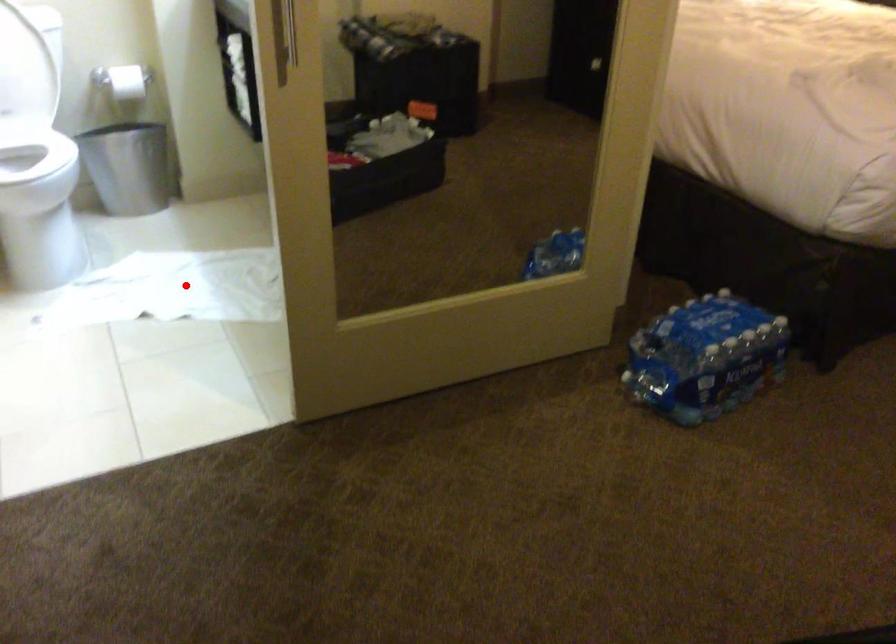
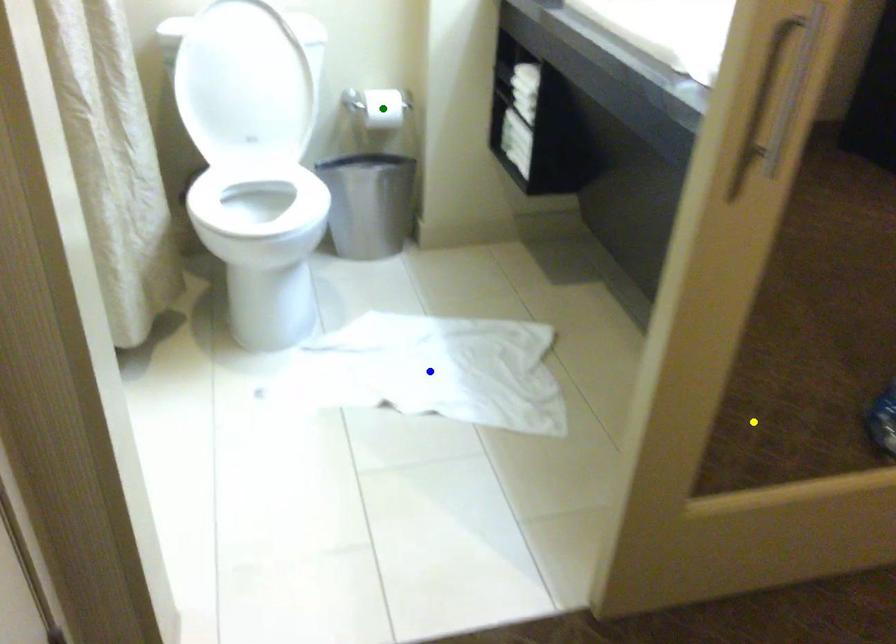
Question: I am providing you with two images of the same scene from different viewpoints. A red point is marked on the first image. You are given multiple points on the second image. Which mark in image 2 goes with the point in image 1?

Choices:
 (A) blue point
 (B) yellow point
 (C) green point

Answer: (A)